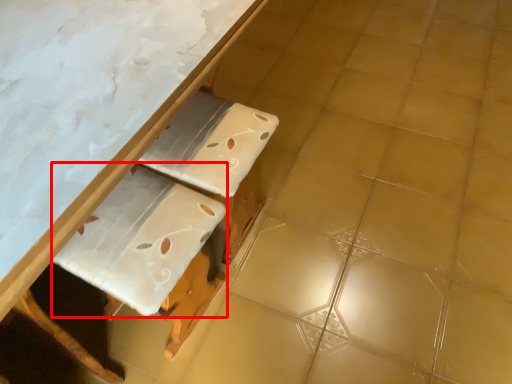
Question: From the image's perspective, what is the correct spatial positioning of cardboard (annotated by the red box) in reference to table?

Choices:
 (A) above
 (B) below

Answer: (B)